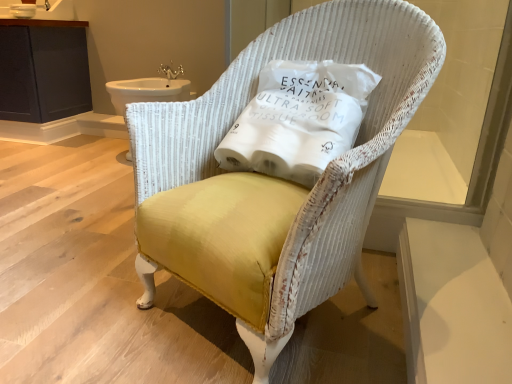
Question: Would you say yellow fabric chair at center is a long distance from white fabric pillow at center?

Choices:
 (A) no
 (B) yes

Answer: (A)

Question: Is yellow fabric chair at center turned away from white fabric pillow at center?

Choices:
 (A) no
 (B) yes

Answer: (B)

Question: From the image's perspective, is yellow fabric chair at center located beneath white fabric pillow at center?

Choices:
 (A) yes
 (B) no

Answer: (A)

Question: Is the position of yellow fabric chair at center more distant than that of white fabric pillow at center?

Choices:
 (A) yes
 (B) no

Answer: (B)

Question: Is yellow fabric chair at center not inside white fabric pillow at center?

Choices:
 (A) yes
 (B) no

Answer: (A)

Question: From a real-world perspective, is white ceramic sink at upper left positioned above or below gold metallic faucet at upper center?

Choices:
 (A) above
 (B) below

Answer: (A)

Question: In the image, is white ceramic sink at upper left on the left side or the right side of gold metallic faucet at upper center?

Choices:
 (A) left
 (B) right

Answer: (A)

Question: In terms of height, does white ceramic sink at upper left look taller or shorter compared to gold metallic faucet at upper center?

Choices:
 (A) short
 (B) tall

Answer: (A)

Question: Considering the positions of white ceramic sink at upper left and gold metallic faucet at upper center in the image, is white ceramic sink at upper left bigger or smaller than gold metallic faucet at upper center?

Choices:
 (A) small
 (B) big

Answer: (A)

Question: From a real-world perspective, is white ceramic sink at upper left positioned above or below dark gray wood cabinet at upper left?

Choices:
 (A) below
 (B) above

Answer: (B)

Question: Is white ceramic sink at upper left taller or shorter than dark gray wood cabinet at upper left?

Choices:
 (A) tall
 (B) short

Answer: (B)

Question: In the image, is white ceramic sink at upper left positioned in front of or behind dark gray wood cabinet at upper left?

Choices:
 (A) behind
 (B) front

Answer: (B)

Question: Is point (71, 8) closer or farther from the camera than point (53, 97)?

Choices:
 (A) farther
 (B) closer

Answer: (A)

Question: Looking at their shapes, would you say yellow fabric chair at center is wider or thinner than dark gray wood cabinet at upper left?

Choices:
 (A) thin
 (B) wide

Answer: (B)

Question: Considering the positions of yellow fabric chair at center and dark gray wood cabinet at upper left in the image, is yellow fabric chair at center bigger or smaller than dark gray wood cabinet at upper left?

Choices:
 (A) small
 (B) big

Answer: (B)